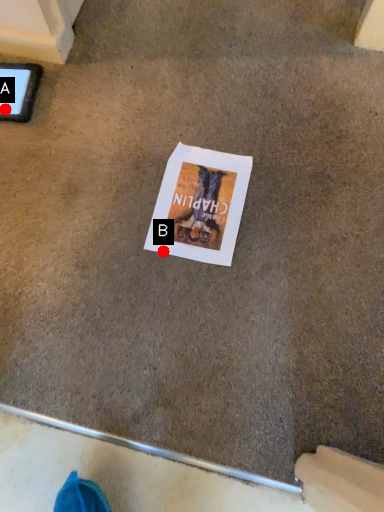
Question: Two points are circled on the image, labeled by A and B beside each circle. Which point is closer to the camera?

Choices:
 (A) A is closer
 (B) B is closer

Answer: (B)